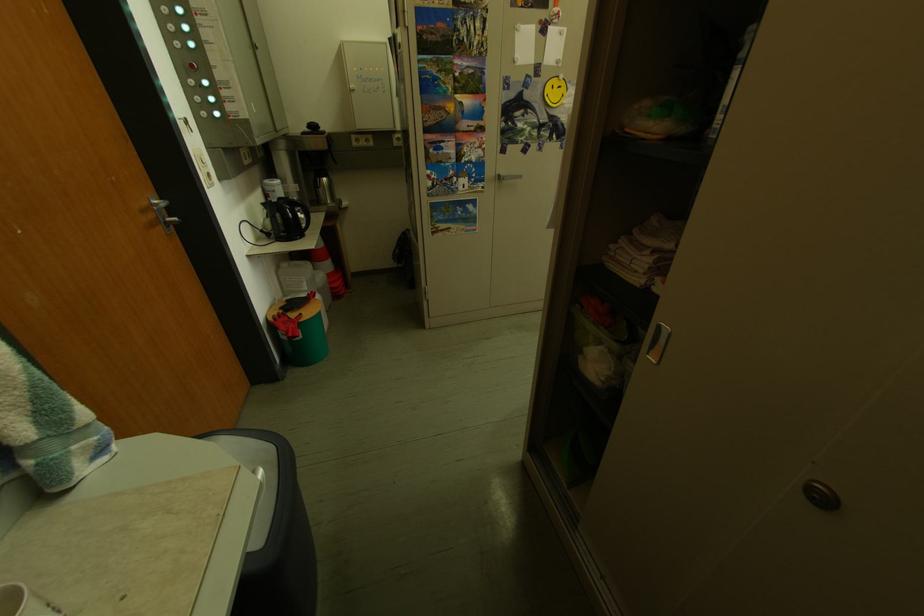
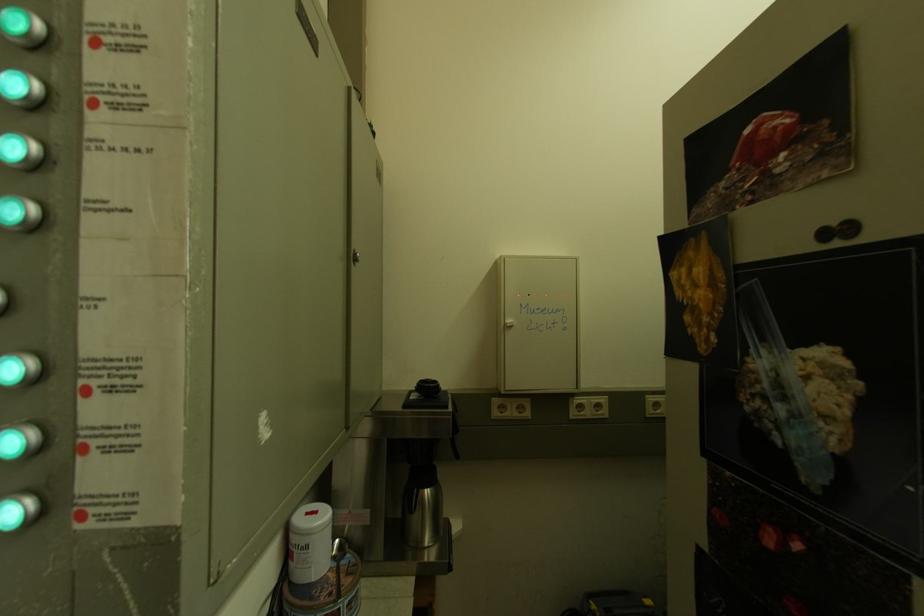
In the second image, find the point that corresponds to (x=315, y=137) in the first image.

(420, 408)